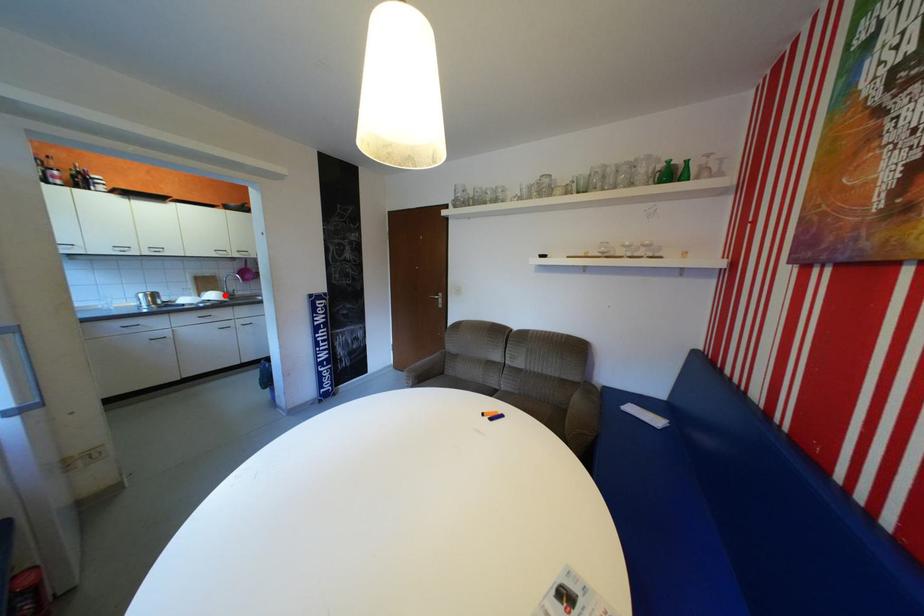
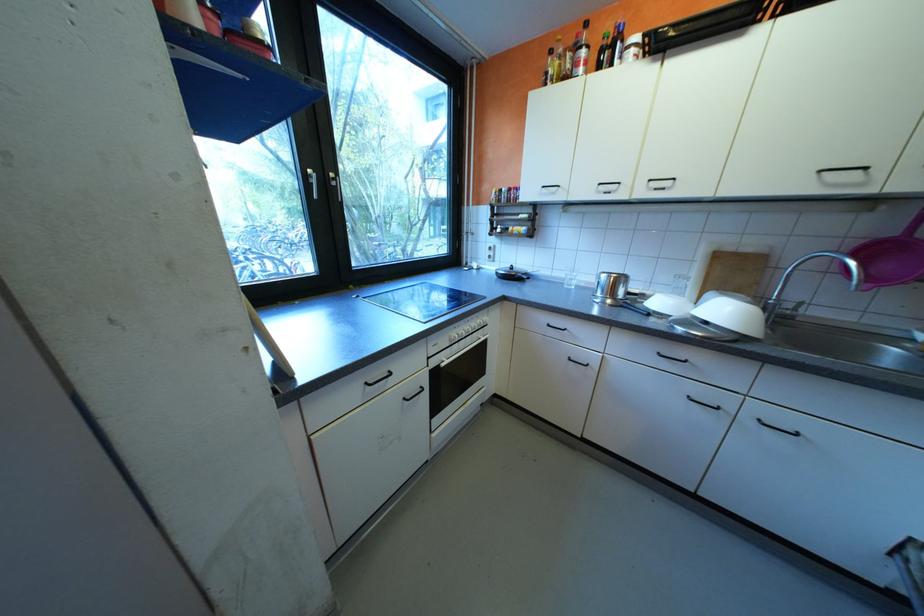
The point at the highlighted location is marked in the first image. Where is the corresponding point in the second image?

(736, 312)